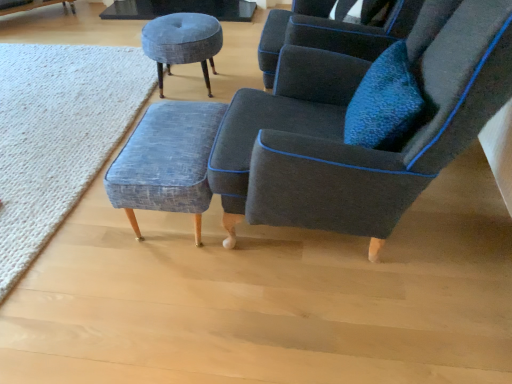
Identify the location of textured gray stool at upper center, which appears as the 1th stool when viewed from the back. This screenshot has width=512, height=384. (182, 42).

The image size is (512, 384). Describe the element at coordinates (58, 135) in the screenshot. I see `textured wool rug at lower left` at that location.

What is the approximate width of dark gray fabric chair at center?

38.12 inches.

What do you see at coordinates (343, 128) in the screenshot? I see `dark gray fabric chair at center` at bounding box center [343, 128].

Locate an element on the screen. Image resolution: width=512 pixels, height=384 pixels. textured gray stool at upper center, which appears as the 1th stool when viewed from the back is located at coordinates (182, 42).

From the image's perspective, does textured wool rug at lower left appear higher than textured gray stool at upper center, the 2th stool when ordered from bottom to top?

No, from the image's perspective, textured wool rug at lower left is not on top of textured gray stool at upper center, the 2th stool when ordered from bottom to top.

In the scene shown: Is textured wool rug at lower left completely or partially outside of textured gray stool at upper center, arranged as the second stool when viewed from the front?

Yes, textured wool rug at lower left is located beyond the bounds of textured gray stool at upper center, arranged as the second stool when viewed from the front.

Can you confirm if textured wool rug at lower left is bigger than textured gray stool at upper center, positioned as the first stool in top-to-bottom order?

Yes, textured wool rug at lower left is bigger than textured gray stool at upper center, positioned as the first stool in top-to-bottom order.

This screenshot has width=512, height=384. I want to click on chair above the textured gray stool at upper center, arranged as the second stool when viewed from the front (from a real-world perspective), so click(x=343, y=128).

From the image's perspective, is dark gray fabric chair at center above textured gray stool at upper center, arranged as the second stool when viewed from the front?

No, from the image's perspective, dark gray fabric chair at center is not on top of textured gray stool at upper center, arranged as the second stool when viewed from the front.

Looking at this image, from a real-world perspective, is dark gray fabric chair at center below textured gray stool at upper center, positioned as the first stool in top-to-bottom order?

Actually, dark gray fabric chair at center is physically above textured gray stool at upper center, positioned as the first stool in top-to-bottom order, in the real world.

In terms of width, does dark gray fabric chair at center look wider or thinner when compared to textured gray stool at upper center, which appears as the 1th stool when viewed from the back?

dark gray fabric chair at center is wider than textured gray stool at upper center, which appears as the 1th stool when viewed from the back.

Which is in front, point (194, 60) or point (212, 127)?

The point (212, 127) is closer to the camera.

Can you confirm if textured gray stool at upper center, arranged as the second stool when viewed from the front, is taller than textured blue fabric stool at center, which is counted as the 2th stool, starting from the back?

Yes, textured gray stool at upper center, arranged as the second stool when viewed from the front, is taller than textured blue fabric stool at center, which is counted as the 2th stool, starting from the back.

Can you confirm if textured gray stool at upper center, arranged as the second stool when viewed from the front, is thinner than textured blue fabric stool at center, acting as the first stool starting from the front?

In fact, textured gray stool at upper center, arranged as the second stool when viewed from the front, might be wider than textured blue fabric stool at center, acting as the first stool starting from the front.

From the image's perspective, is dark gray fabric chair at center above or below textured blue fabric stool at center, which is the 1th stool in bottom-to-top order?

Clearly, from the image's perspective, dark gray fabric chair at center is above textured blue fabric stool at center, which is the 1th stool in bottom-to-top order.

Is dark gray fabric chair at center positioned far away from textured blue fabric stool at center, acting as the 2th stool starting from the top?

dark gray fabric chair at center is actually quite close to textured blue fabric stool at center, acting as the 2th stool starting from the top.

Which object is wider, dark gray fabric chair at center or textured blue fabric stool at center, acting as the first stool starting from the front?

dark gray fabric chair at center.

Considering the positions of objects dark gray fabric chair at center and textured blue fabric stool at center, which is the 1th stool in bottom-to-top order, in the image provided, who is in front, dark gray fabric chair at center or textured blue fabric stool at center, which is the 1th stool in bottom-to-top order,?

dark gray fabric chair at center is more forward.

Which is more to the right, textured blue fabric stool at center, which is counted as the 2th stool, starting from the back, or textured wool rug at lower left?

textured blue fabric stool at center, which is counted as the 2th stool, starting from the back.

In order to click on mat on the left of textured blue fabric stool at center, acting as the first stool starting from the front in this screenshot , I will do `click(58, 135)`.

Is textured blue fabric stool at center, which is counted as the 2th stool, starting from the back, directly adjacent to textured wool rug at lower left?

textured blue fabric stool at center, which is counted as the 2th stool, starting from the back, and textured wool rug at lower left are clearly separated.

Is textured gray stool at upper center, positioned as the first stool in top-to-bottom order, facing towards textured wool rug at lower left?

No, textured gray stool at upper center, positioned as the first stool in top-to-bottom order, is not aimed at textured wool rug at lower left.

Identify the location of mat below the textured gray stool at upper center, which appears as the 1th stool when viewed from the back (from a real-world perspective). This screenshot has width=512, height=384. (x=58, y=135).

Which object is further away from the camera, dark gray fabric chair at center or textured wool rug at lower left?

Positioned behind is textured wool rug at lower left.

From a real-world perspective, is dark gray fabric chair at center physically located above or below textured wool rug at lower left?

dark gray fabric chair at center is situated higher than textured wool rug at lower left in the real world.

Between dark gray fabric chair at center and textured wool rug at lower left, which one has larger width?

textured wool rug at lower left.

Identify the location of mat on the left of the textured gray stool at upper center, which appears as the 1th stool when viewed from the back. This screenshot has height=384, width=512. (58, 135).

There is a textured gray stool at upper center, arranged as the second stool when viewed from the front. Identify the location of chair above it (from a real-world perspective). This screenshot has height=384, width=512. (343, 128).

Which object lies further to the anchor point textured wool rug at lower left, textured blue fabric stool at center, which is counted as the 2th stool, starting from the back, or textured gray stool at upper center, which appears as the 1th stool when viewed from the back?

The object further to textured wool rug at lower left is textured blue fabric stool at center, which is counted as the 2th stool, starting from the back.

When comparing their distances from dark gray fabric chair at center, does textured blue fabric stool at center, which is the 1th stool in bottom-to-top order, or textured wool rug at lower left seem closer?

Among the two, textured blue fabric stool at center, which is the 1th stool in bottom-to-top order, is located nearer to dark gray fabric chair at center.

From the image, which object appears to be nearer to dark gray fabric chair at center, textured gray stool at upper center, arranged as the second stool when viewed from the front, or textured blue fabric stool at center, acting as the 2th stool starting from the top?

textured blue fabric stool at center, acting as the 2th stool starting from the top, is positioned closer to the anchor dark gray fabric chair at center.

Which object lies nearer to the anchor point textured gray stool at upper center, the 2th stool when ordered from bottom to top, textured wool rug at lower left or dark gray fabric chair at center?

The object closer to textured gray stool at upper center, the 2th stool when ordered from bottom to top, is textured wool rug at lower left.

Considering their positions, is textured blue fabric stool at center, which is the 1th stool in bottom-to-top order, positioned closer to textured gray stool at upper center, which appears as the 1th stool when viewed from the back, than dark gray fabric chair at center?

Based on the image, textured blue fabric stool at center, which is the 1th stool in bottom-to-top order, appears to be nearer to textured gray stool at upper center, which appears as the 1th stool when viewed from the back.

Based on their spatial positions, is dark gray fabric chair at center or textured wool rug at lower left closer to textured gray stool at upper center, arranged as the second stool when viewed from the front?

textured wool rug at lower left.

Which object lies further to the anchor point textured blue fabric stool at center, acting as the 2th stool starting from the top, dark gray fabric chair at center or textured wool rug at lower left?

textured wool rug at lower left is further to textured blue fabric stool at center, acting as the 2th stool starting from the top.

Based on their spatial positions, is textured gray stool at upper center, positioned as the first stool in top-to-bottom order, or textured wool rug at lower left further from dark gray fabric chair at center?

textured wool rug at lower left is further to dark gray fabric chair at center.

This screenshot has height=384, width=512. Find the location of `stool between textured wool rug at lower left and textured blue fabric stool at center, which is the 1th stool in bottom-to-top order, from left to right`. stool between textured wool rug at lower left and textured blue fabric stool at center, which is the 1th stool in bottom-to-top order, from left to right is located at coordinates (182, 42).

Find the location of `stool between dark gray fabric chair at center and textured gray stool at upper center, arranged as the second stool when viewed from the front, along the z-axis`. stool between dark gray fabric chair at center and textured gray stool at upper center, arranged as the second stool when viewed from the front, along the z-axis is located at coordinates (166, 162).